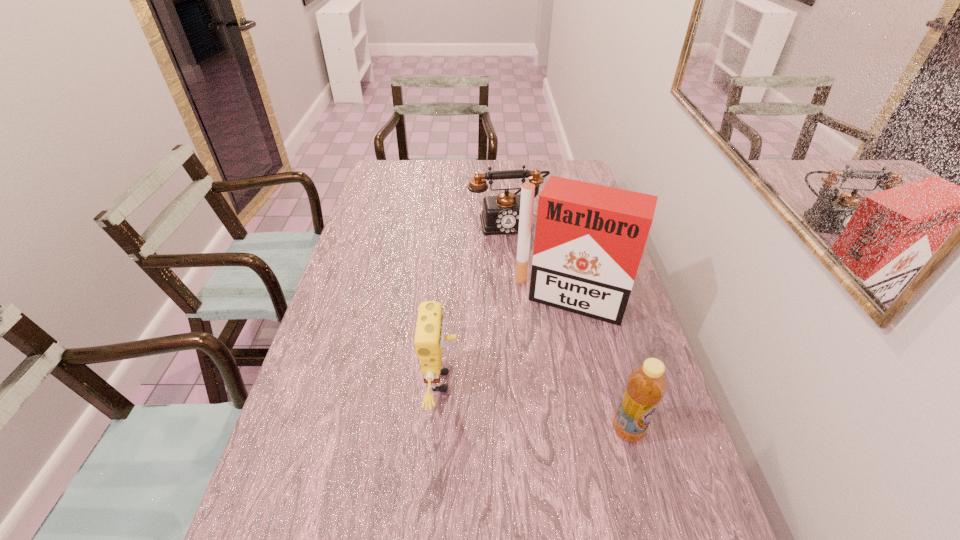
The height and width of the screenshot is (540, 960). Identify the location of vacant region located on the front-facing side of the third nearest object. (531, 385).

Where is `free space located 0.140m on the front-facing side of the third nearest object`? free space located 0.140m on the front-facing side of the third nearest object is located at coordinates (540, 361).

Where is `vacant space located on the front-facing side of the third nearest object`? vacant space located on the front-facing side of the third nearest object is located at coordinates (516, 426).

This screenshot has height=540, width=960. I want to click on bottle located in the right edge section of the desktop, so click(x=646, y=385).

Find the location of a particular element. This screenshot has height=540, width=960. cigarette case at the right edge is located at coordinates (589, 239).

In order to click on free space at the far edge of the desktop in this screenshot , I will do `click(500, 171)`.

In the image, there is a desktop. In order to click on vacant space at the near edge in this screenshot , I will do `click(384, 511)`.

This screenshot has width=960, height=540. In the image, there is a desktop. Find the location of `free space at the left edge`. free space at the left edge is located at coordinates (353, 300).

The image size is (960, 540). Find the location of `free space at the right edge`. free space at the right edge is located at coordinates click(674, 425).

Image resolution: width=960 pixels, height=540 pixels. I want to click on free space that is in between the bottle and the sponge, so click(535, 406).